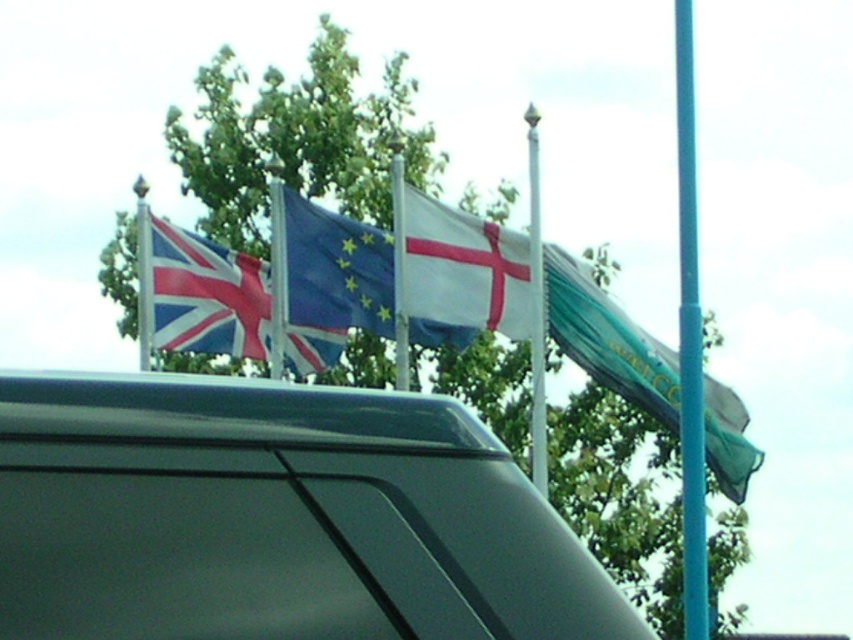
Question: Which point appears closest to the camera in this image?

Choices:
 (A) (563, 262)
 (B) (532, 273)
 (C) (289, 323)

Answer: (B)

Question: Which object is the closest to the textured fabric flag at left?

Choices:
 (A) blue metallic pole at right
 (B) metallic gray car at center
 (C) blue fabric flag at center
 (D) silver metallic pole at center

Answer: (C)

Question: Does white matte flag at center lie in front of silver metallic pole at center?

Choices:
 (A) no
 (B) yes

Answer: (A)

Question: Is white matte flag at center positioned at the back of white plastic flagpole at center?

Choices:
 (A) no
 (B) yes

Answer: (B)

Question: Among these objects, which one is nearest to the camera?

Choices:
 (A) white plastic flagpole at center
 (B) silver metallic pole at center
 (C) blue metallic pole at right

Answer: (C)

Question: Does metallic gray car at center have a larger size compared to silver metallic pole at center?

Choices:
 (A) no
 (B) yes

Answer: (B)